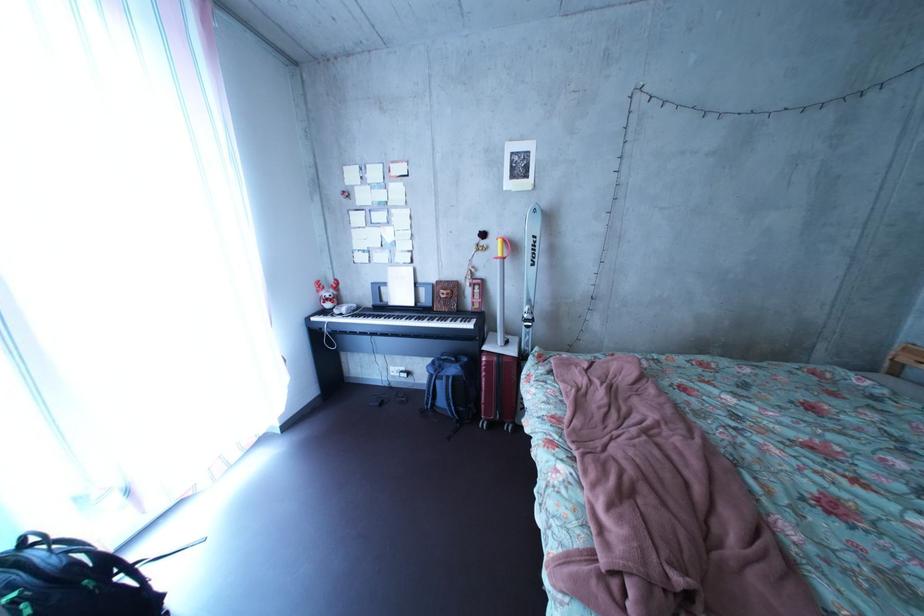
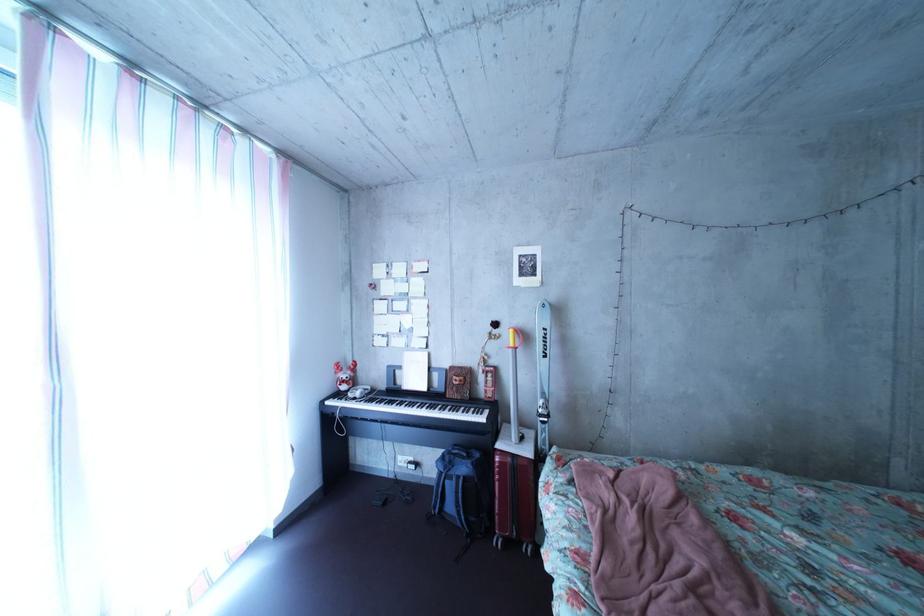
Find the pixel in the second image that matches point (468, 379) in the first image.

(479, 477)